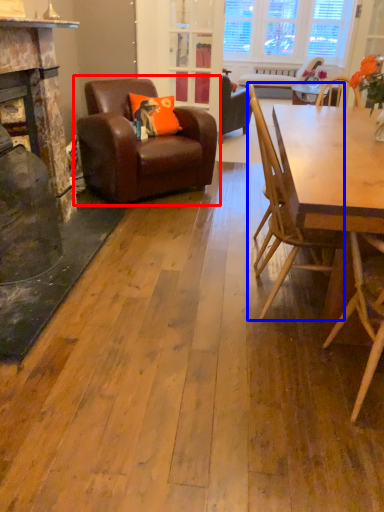
Question: Which point is further to the camera, chair (highlighted by a red box) or chair (highlighted by a blue box)?

Choices:
 (A) chair
 (B) chair

Answer: (A)